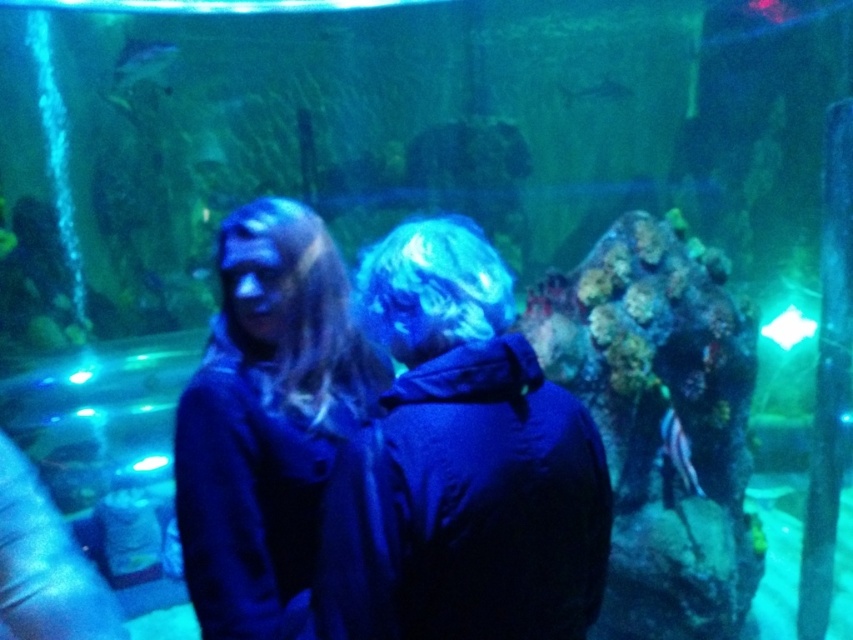
Question: Does shiny silver fish at upper left appear under shiny silver fish at upper center?

Choices:
 (A) no
 (B) yes

Answer: (B)

Question: Among these objects, which one is farthest from the camera?

Choices:
 (A) dark blue fabric at center
 (B) striped fabric fish at center

Answer: (B)

Question: Is dark blue fabric at center above shiny silver fish at upper left?

Choices:
 (A) yes
 (B) no

Answer: (B)

Question: Which is farther from the matte blue scarf at center?

Choices:
 (A) shiny silver fish at upper left
 (B) dark blue fabric at center

Answer: (A)

Question: Does shiny silver fish at upper left have a smaller size compared to shiny silver fish at upper center?

Choices:
 (A) no
 (B) yes

Answer: (A)

Question: Estimate the real-world distances between objects in this image. Which object is farther from the dark blue fabric at center?

Choices:
 (A) shiny silver fish at upper center
 (B) striped fabric fish at center
 (C) matte blue scarf at center
 (D) shiny silver fish at upper left

Answer: (A)